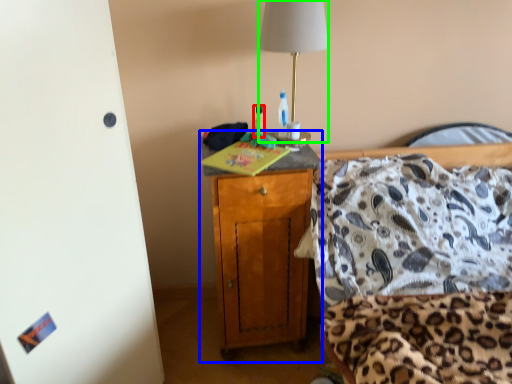
Question: Which object is positioned farthest from bottle (highlighted by a red box)? Select from cabinetry (highlighted by a blue box) and lamp (highlighted by a green box).

Choices:
 (A) cabinetry
 (B) lamp

Answer: (A)